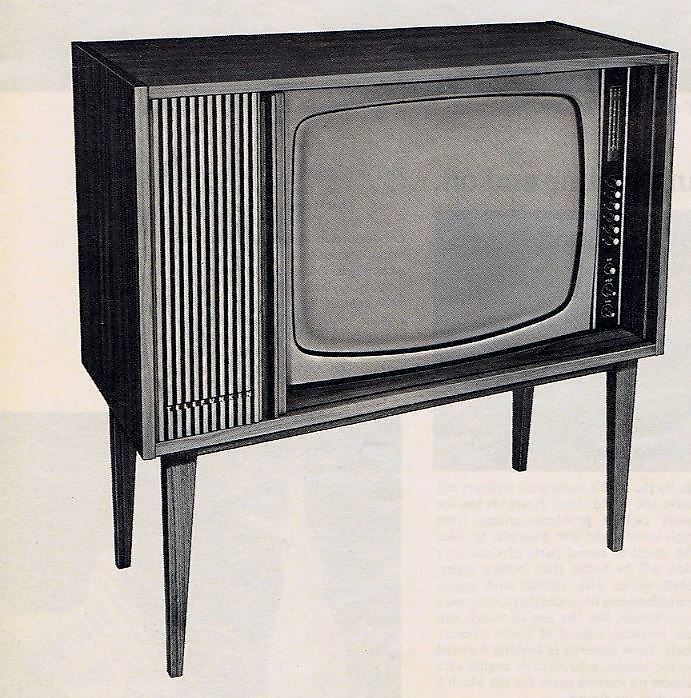
In order to click on frame in this screenshot , I will do `click(332, 58)`.